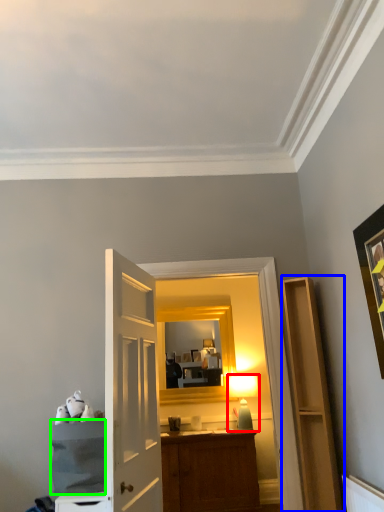
Question: Which object is positioned farthest from table lamp (highlighted by a red box)? Select from cabinetry (highlighted by a blue box) and cabinetry (highlighted by a green box).

Choices:
 (A) cabinetry
 (B) cabinetry

Answer: (B)